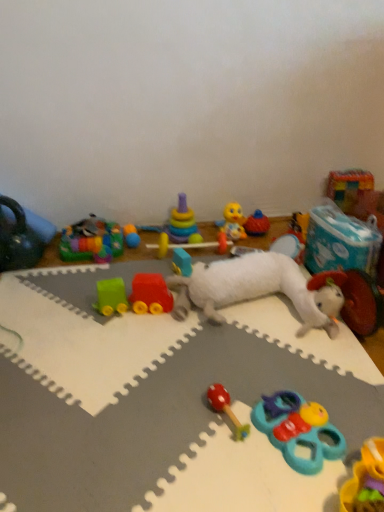
Locate an element on the screen. The width and height of the screenshot is (384, 512). vacant space to the right of rubber ball at center, the thirteenth toy when ordered from right to left is located at coordinates (168, 247).